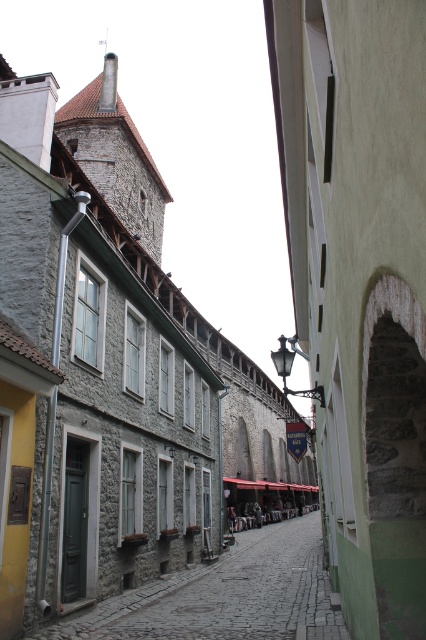
You are a tourist standing at the entrance of the street. You see the smooth stone arch at center and the stone paved alley at center. Which object is taller?

The smooth stone arch at center is taller than the stone paved alley at center.

You are a tourist standing at the entrance of the street and want to take a photo of the smooth stone arch at center and the stone paved alley at center. Which object is positioned higher in the image?

The smooth stone arch at center is located above the stone paved alley at center, so it is positioned higher in the image.

You are a tourist standing at the entrance of the street and want to take a photo of the smooth stone arch at center and the stone paved alley at center. Which object should you focus on first to ensure it appears larger in your photo?

The smooth stone arch at center is closer to the viewer than the stone paved alley at center, so focusing on the smooth stone arch at center will make it appear larger in the photo.